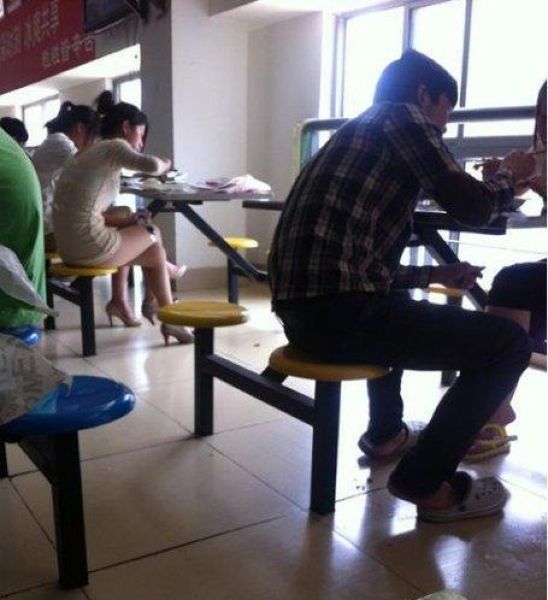
What are the coordinates of `tile floor` in the screenshot? It's located at (279, 548).